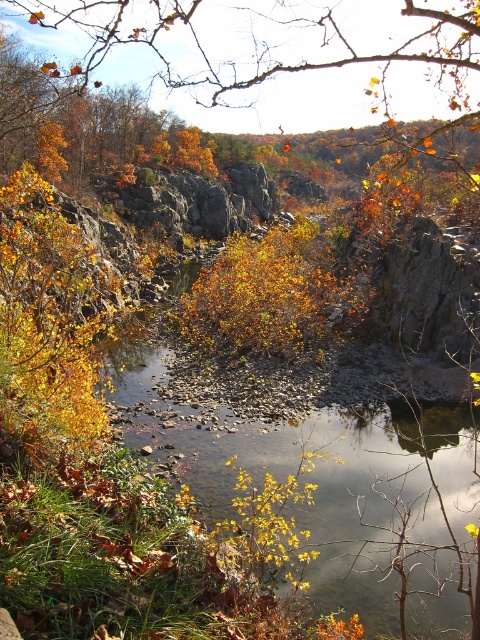
Question: Which object is farther from the camera taking this photo?

Choices:
 (A) smooth rock river at center
 (B) orange leafy branch at upper center

Answer: (A)

Question: Among these points, which one is farthest from the camera?

Choices:
 (A) (423, 506)
 (B) (432, 65)

Answer: (B)

Question: Can you confirm if smooth rock river at center is positioned to the right of orange leafy branch at upper center?

Choices:
 (A) no
 (B) yes

Answer: (A)

Question: Is smooth rock river at center bigger than orange leafy branch at upper center?

Choices:
 (A) no
 (B) yes

Answer: (A)

Question: From the image, what is the correct spatial relationship of smooth rock river at center in relation to orange leafy branch at upper center?

Choices:
 (A) right
 (B) left

Answer: (B)